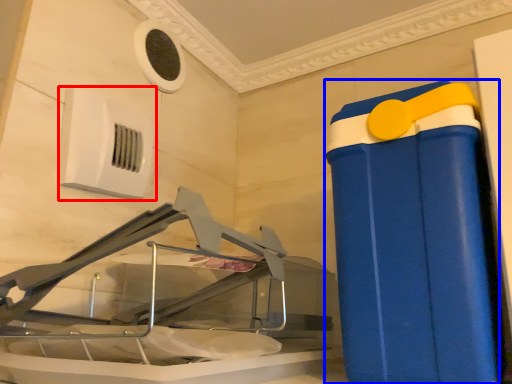
Question: Which object appears farthest to the camera in this image, air conditioning (highlighted by a red box) or waste container (highlighted by a blue box)?

Choices:
 (A) air conditioning
 (B) waste container

Answer: (A)